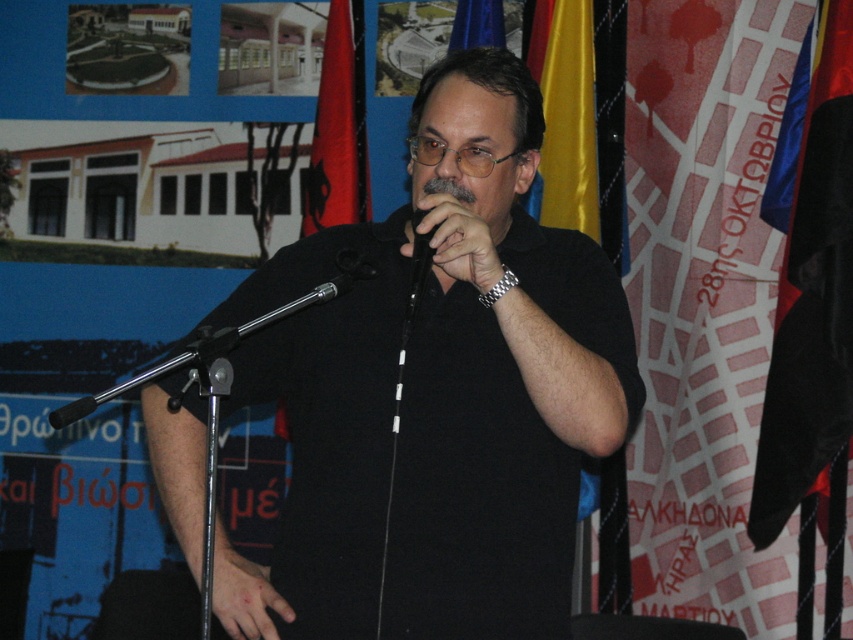
In the scene shown: You are an event planner setting up a stage for a presentation. You need to ensure that the black matte shirt at center is visible to the audience. Since the yellow satin flag at upper right is behind it, could the flag block the view of the shirt?

The black matte shirt at center is positioned under the yellow satin flag at upper right, so the flag would not block the view of the shirt as it is placed above it.

You are a sound technician setting up for a presentation. You have two microphones at the center of the stage. The black leather microphone at center and the black metallic microphone at center are both in front of the speaker. The speaker needs to choose one that is closer to his right hand. Which microphone should he choose?

The black leather microphone at center and black metallic microphone at center are 9.57 inches apart from each other. Without knowing their exact positions relative to the speaker, it is impossible to determine which is closer to his right hand.

You are a photographer positioned in front of the black matte shirt at center. You want to capture a closeup shot of the shirt without any distortion. Considering your current distance, is the shirt within the optimal focus range of your standard 50mm lens which has a minimum focusing distance of 0.7 meters?

The black matte shirt at center is 1.97 meters away from viewer. Since the minimum focusing distance is 0.7 meters, the shirt is within the optimal focus range and can be captured clearly without distortion.